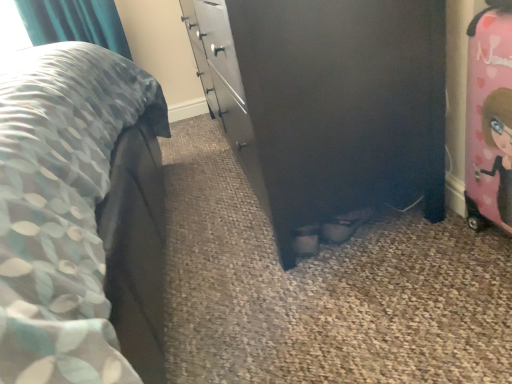
Question: Considering the positions of black matte chest of drawers at center and pink glossy suitcase at right in the image, is black matte chest of drawers at center taller or shorter than pink glossy suitcase at right?

Choices:
 (A) short
 (B) tall

Answer: (B)

Question: Choose the correct answer: Is black matte chest of drawers at center inside pink glossy suitcase at right or outside it?

Choices:
 (A) outside
 (B) inside

Answer: (A)

Question: From a real-world perspective, relative to pink glossy suitcase at right, is black matte chest of drawers at center vertically above or below?

Choices:
 (A) below
 (B) above

Answer: (B)

Question: From a real-world perspective, is pink glossy suitcase at right above or below black matte chest of drawers at center?

Choices:
 (A) below
 (B) above

Answer: (A)

Question: Visually, is pink glossy suitcase at right positioned to the left or to the right of black matte chest of drawers at center?

Choices:
 (A) right
 (B) left

Answer: (A)

Question: Is pink glossy suitcase at right in front of or behind black matte chest of drawers at center in the image?

Choices:
 (A) behind
 (B) front

Answer: (B)

Question: Which is correct: pink glossy suitcase at right is inside black matte chest of drawers at center, or outside of it?

Choices:
 (A) outside
 (B) inside

Answer: (A)